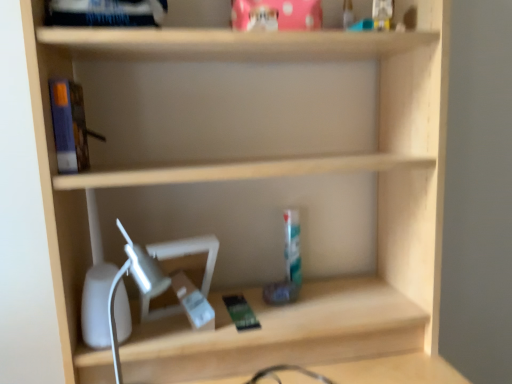
Question: From a real-world perspective, relative to white plastic table lamp at lower left, is blue matte book at left vertically above or below?

Choices:
 (A) above
 (B) below

Answer: (A)

Question: Does point (50, 79) appear closer or farther from the camera than point (139, 264)?

Choices:
 (A) closer
 (B) farther

Answer: (B)

Question: Is blue matte book at left spatially inside white plastic table lamp at lower left, or outside of it?

Choices:
 (A) outside
 (B) inside

Answer: (A)

Question: Considering the positions of white plastic table lamp at lower left and blue matte book at left in the image, is white plastic table lamp at lower left taller or shorter than blue matte book at left?

Choices:
 (A) tall
 (B) short

Answer: (A)

Question: Based on their positions, is white plastic table lamp at lower left located to the left or right of blue matte book at left?

Choices:
 (A) left
 (B) right

Answer: (B)

Question: From a real-world perspective, relative to blue matte book at left, is white plastic table lamp at lower left vertically above or below?

Choices:
 (A) above
 (B) below

Answer: (B)

Question: Do you think white plastic table lamp at lower left is within blue matte book at left, or outside of it?

Choices:
 (A) inside
 (B) outside

Answer: (B)